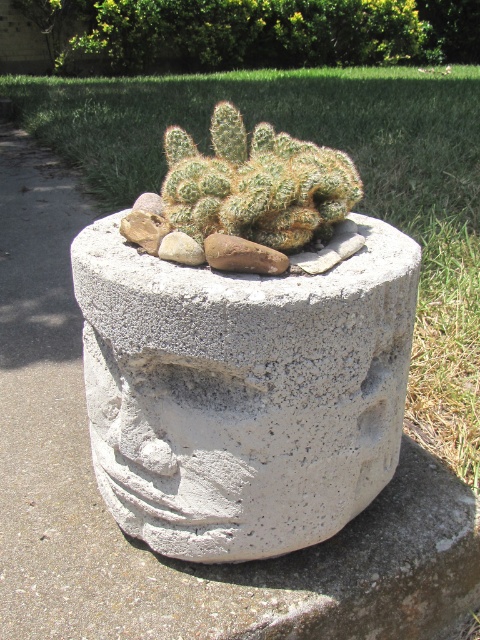
Who is lower down, white concrete planter at center or green spiky cactus at center?

white concrete planter at center is lower down.

Can you confirm if white concrete planter at center is thinner than green spiky cactus at center?

Yes, white concrete planter at center is thinner than green spiky cactus at center.

Does point (252, 368) lie behind point (435, 355)?

No, it is in front of (435, 355).

Identify the location of white concrete planter at center. This screenshot has height=640, width=480. (242, 392).